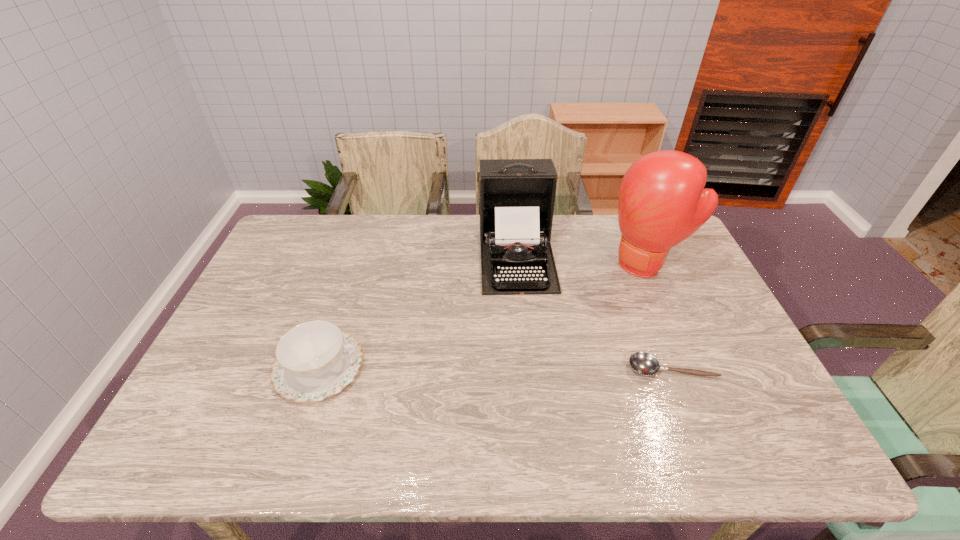
You are a GUI agent. You are given a task and a screenshot of the screen. Output one action in this format:
    pyautogui.click(x=<x>, y=<y>)
    Task: Click on the vacant position located inside the open case of the second tallest object
    This screenshot has height=540, width=960.
    Given the screenshot: What is the action you would take?
    pyautogui.click(x=524, y=310)

Locate an element on the screen. This screenshot has height=540, width=960. free location located 0.250m on the striking surface of the boxing glove is located at coordinates (571, 321).

Locate an element on the screen. The image size is (960, 540). vacant space located 0.190m on the striking surface of the boxing glove is located at coordinates (585, 311).

Locate an element on the screen. The height and width of the screenshot is (540, 960). free location located 0.230m on the striking surface of the boxing glove is located at coordinates (576, 318).

Locate an element on the screen. typewriter that is positioned at the far edge is located at coordinates (517, 196).

Image resolution: width=960 pixels, height=540 pixels. Find the location of `boxing glove positioned at the far edge`. boxing glove positioned at the far edge is located at coordinates (662, 201).

This screenshot has height=540, width=960. I want to click on object that is at the near edge, so [x=314, y=360].

Where is `ladle that is positioned at the right edge`? ladle that is positioned at the right edge is located at coordinates point(643,363).

Where is `boxing glove at the right edge`? This screenshot has height=540, width=960. boxing glove at the right edge is located at coordinates (662, 201).

You are a GUI agent. You are given a task and a screenshot of the screen. Output one action in this format:
    pyautogui.click(x=<x>, y=<y>)
    Task: Click on the object positioned at the far right corner
    
    Given the screenshot: What is the action you would take?
    pyautogui.click(x=662, y=201)